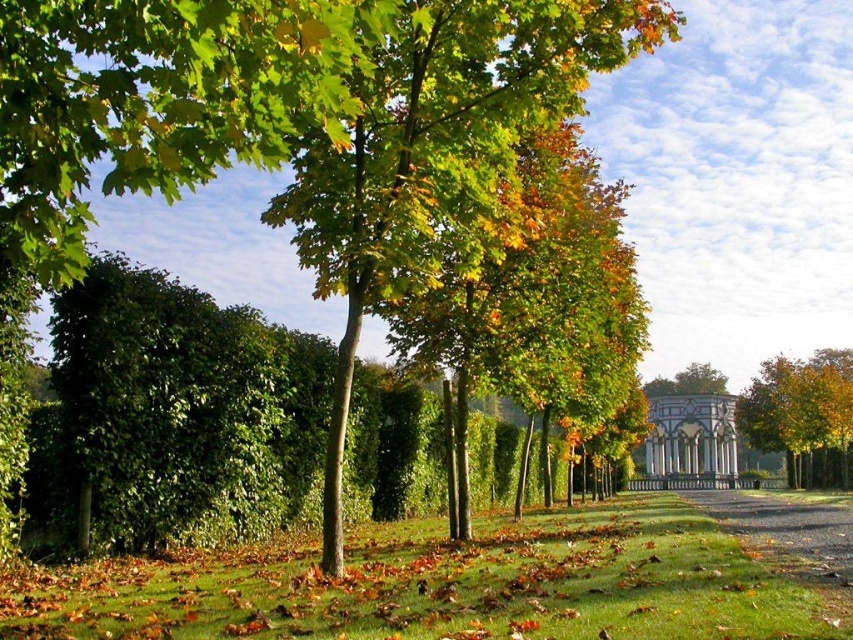
Question: Which point is closer to the camera taking this photo?

Choices:
 (A) (822, 378)
 (B) (613, 532)
 (C) (73, 182)

Answer: (C)

Question: Can you confirm if green leafy tree at center is positioned below green grass at center?

Choices:
 (A) no
 (B) yes

Answer: (A)

Question: Which object appears closest to the camera in this image?

Choices:
 (A) golden yellow leaves at center
 (B) green leafy hedge at center

Answer: (B)

Question: Does green leafy tree at center appear on the right side of green grass at center?

Choices:
 (A) yes
 (B) no

Answer: (B)

Question: Does green leafy hedge at center appear on the right side of white marble gazebo at center?

Choices:
 (A) yes
 (B) no

Answer: (B)

Question: Among these points, which one is nearest to the camera?

Choices:
 (A) (664, 448)
 (B) (718, 605)

Answer: (B)